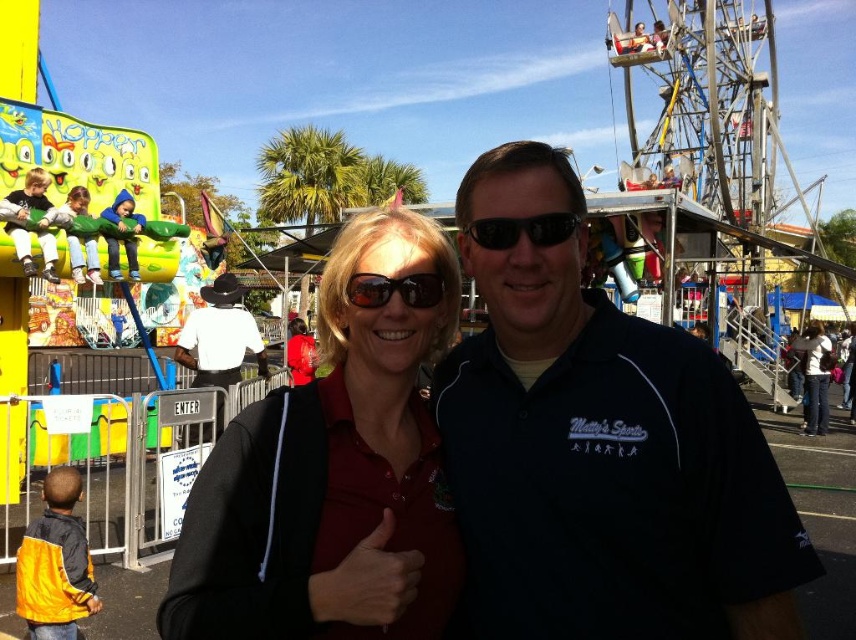
Between dark blue shirt at center and white fabric purse at right, which one has more height?

Standing taller between the two is dark blue shirt at center.

Who is more forward, [563,554] or [807,358]?

Point [563,554] is in front.

Find the location of a particular element. Image resolution: width=856 pixels, height=640 pixels. dark blue shirt at center is located at coordinates (599, 451).

Between point (421, 464) and point (346, 289), which one is positioned in front?

Positioned in front is point (421, 464).

Which of these two, matte black jacket at center or sunglasses at center, stands shorter?

With less height is sunglasses at center.

Who is more distant from viewer, (277, 456) or (407, 301)?

The point (407, 301) is more distant.

Locate an element on the screen. This screenshot has width=856, height=640. matte black jacket at center is located at coordinates (331, 476).

Between point (522, 324) and point (515, 237), which one is positioned in front?

Point (515, 237) is more forward.

Is dark blue shirt at center smaller than black matte sunglasses at center?

No.

Image resolution: width=856 pixels, height=640 pixels. I want to click on dark blue shirt at center, so click(x=599, y=451).